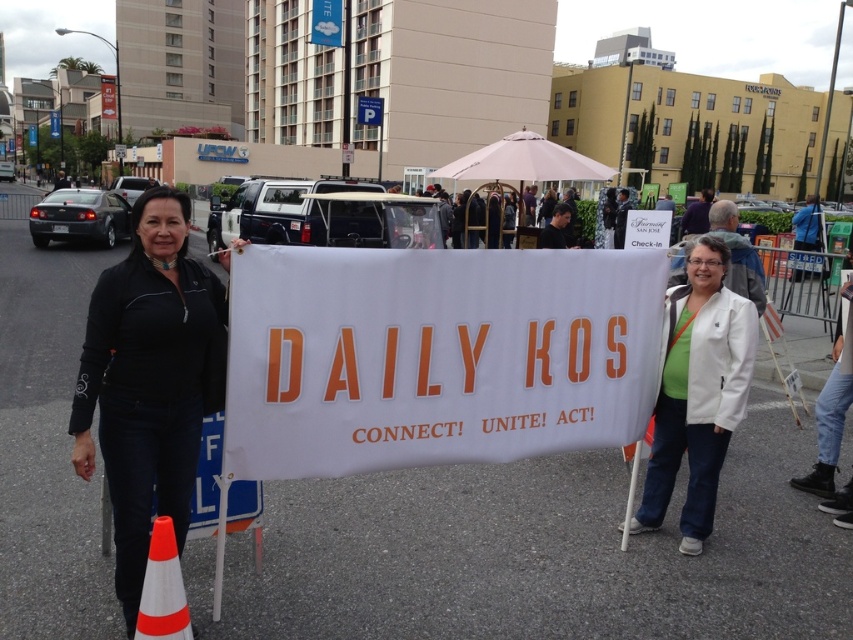
You are a photographer at the event and want to capture a photo where both the white matte jacket at center and the orange and white plastic traffic cone at lower left are visible. Based on their positions, which object should you focus on first to ensure both are in frame?

The white matte jacket at center is located above the orange and white plastic traffic cone at lower left, so you should focus on the white matte jacket at center first to ensure both are in frame.

You are a photographer trying to capture the slogan on the white paper banner at center without any obstructions. Given that the black fabric at center is positioned behind the banner, will you be able to take a clear photo of the slogan?

The black fabric at center is behind the white paper banner at center, so the slogan on the white paper banner at center will not be obstructed by the black fabric at center. You can take a clear photo of the slogan.

You are a photographer standing at the back of the crowd. You want to take a photo of the black fabric at center and the light colored jacket at lower right. What is the minimum distance you need to move forward to ensure both are in frame?

The minimum distance you need to move forward is 2.51 meters to ensure both the black fabric at center and the light colored jacket at lower right are in frame.